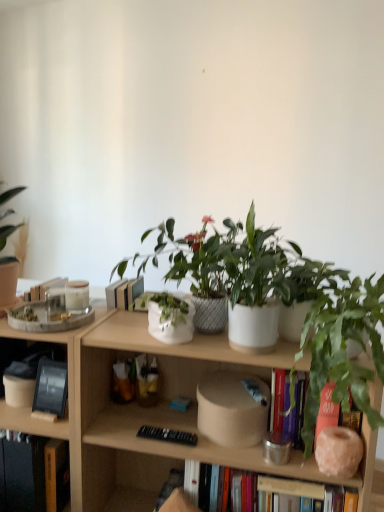
Question: Can you confirm if hardcover book at lower left, arranged as the first book when ordered from the bottom, is shorter than black matte tablet at left, the first book when ordered from top to bottom?

Choices:
 (A) no
 (B) yes

Answer: (A)

Question: Is hardcover book at lower left, arranged as the 2th book when viewed from the top, to the right of black matte tablet at left, which ranks as the 2th book in bottom-to-top order, from the viewer's perspective?

Choices:
 (A) yes
 (B) no

Answer: (B)

Question: Would you say hardcover book at lower left, arranged as the 2th book when viewed from the top, contains black matte tablet at left, the first book when ordered from top to bottom?

Choices:
 (A) yes
 (B) no

Answer: (B)

Question: Is hardcover book at lower left, arranged as the first book when ordered from the bottom, closer to camera compared to black matte tablet at left, which ranks as the 2th book in bottom-to-top order?

Choices:
 (A) no
 (B) yes

Answer: (B)

Question: Is hardcover book at lower left, arranged as the 2th book when viewed from the top, next to black matte tablet at left, which ranks as the 2th book in bottom-to-top order?

Choices:
 (A) no
 (B) yes

Answer: (A)

Question: From a real-world perspective, is hardcover book at lower left, arranged as the first book when ordered from the bottom, below black matte tablet at left, the first book when ordered from top to bottom?

Choices:
 (A) yes
 (B) no

Answer: (A)

Question: From the image's perspective, would you say green matte houseplant at right is positioned over hardcover book at lower left, arranged as the 2th book when viewed from the top?

Choices:
 (A) yes
 (B) no

Answer: (A)

Question: From a real-world perspective, does green matte houseplant at right sit lower than hardcover book at lower left, arranged as the first book when ordered from the bottom?

Choices:
 (A) no
 (B) yes

Answer: (A)

Question: Is green matte houseplant at right not within hardcover book at lower left, arranged as the first book when ordered from the bottom?

Choices:
 (A) no
 (B) yes

Answer: (B)

Question: Can you confirm if green matte houseplant at right is taller than hardcover book at lower left, arranged as the 2th book when viewed from the top?

Choices:
 (A) no
 (B) yes

Answer: (B)

Question: Can you confirm if green matte houseplant at right is bigger than hardcover book at lower left, arranged as the 2th book when viewed from the top?

Choices:
 (A) yes
 (B) no

Answer: (A)

Question: Are green matte houseplant at right and hardcover book at lower left, arranged as the 2th book when viewed from the top, making contact?

Choices:
 (A) yes
 (B) no

Answer: (B)

Question: Considering the relative sizes of black matte tablet at left, which ranks as the 2th book in bottom-to-top order, and green matte houseplant at right in the image provided, is black matte tablet at left, which ranks as the 2th book in bottom-to-top order, taller than green matte houseplant at right?

Choices:
 (A) yes
 (B) no

Answer: (B)